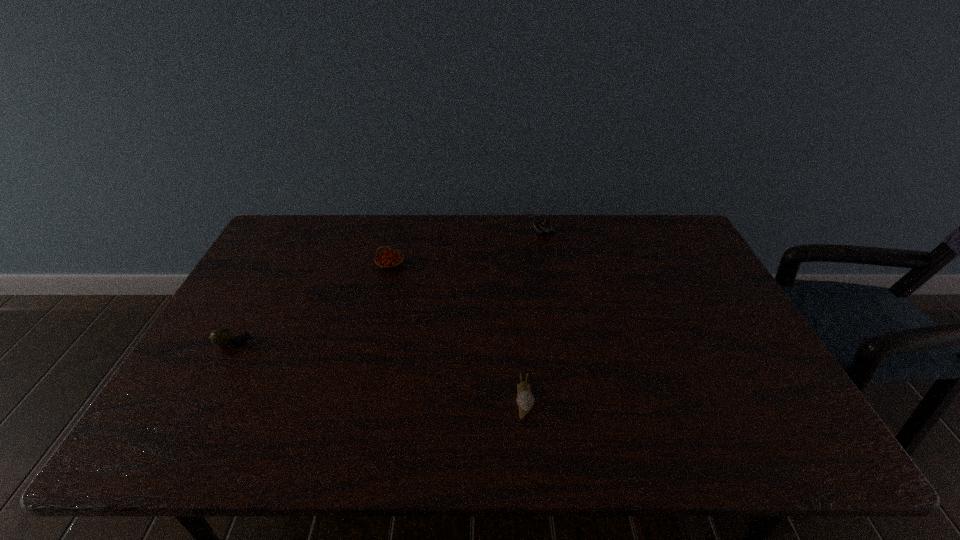
Locate an element on the screen. The height and width of the screenshot is (540, 960). the tallest escargot is located at coordinates (546, 225).

Where is `the farthest escargot`? The height and width of the screenshot is (540, 960). the farthest escargot is located at coordinates (546, 225).

Identify the location of the second tallest object. (389, 259).

The image size is (960, 540). In order to click on the second farthest object in this screenshot , I will do `click(389, 259)`.

Locate an element on the screen. This screenshot has height=540, width=960. the second tallest escargot is located at coordinates (222, 337).

Where is `the leftmost object`? The height and width of the screenshot is (540, 960). the leftmost object is located at coordinates (222, 337).

Where is `the second escargot from left to right`? the second escargot from left to right is located at coordinates (525, 400).

Locate an element on the screen. the nearest escargot is located at coordinates (525, 400).

At what (x,y) coordinates should I click in order to perform the action: click on vacant region located on the face of the farthest escargot. Please return your answer as a coordinate pair (x, y). This screenshot has height=540, width=960. Looking at the image, I should click on (474, 232).

Identify the location of free location located on the face of the farthest escargot. Image resolution: width=960 pixels, height=540 pixels. (468, 232).